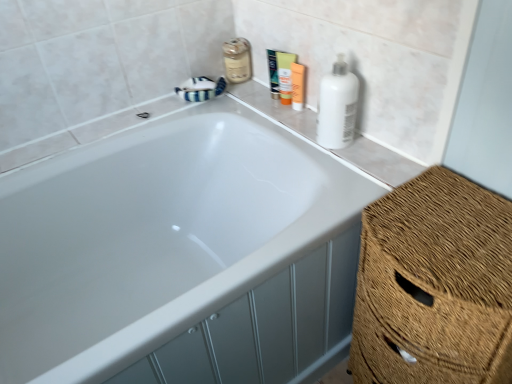
Where is `vacant area that is in front of green plastic tube at upper center, which is the 3th toiletry in right-to-left order`? vacant area that is in front of green plastic tube at upper center, which is the 3th toiletry in right-to-left order is located at coordinates coord(289,109).